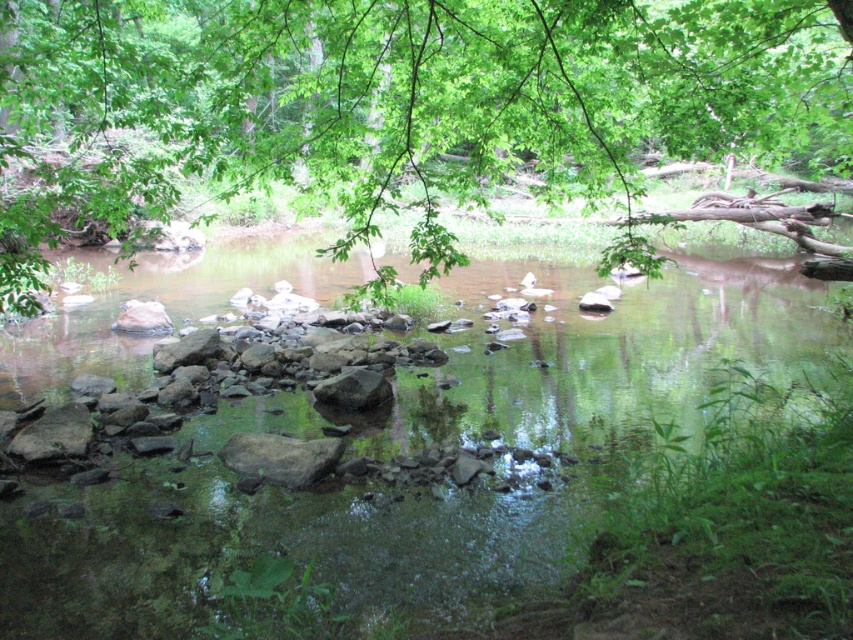
Who is positioned more to the right, green smooth water at center or green leafy branch at upper center?

From the viewer's perspective, green leafy branch at upper center appears more on the right side.

Can you confirm if green smooth water at center is shorter than green leafy branch at upper center?

Correct, green smooth water at center is not as tall as green leafy branch at upper center.

The height and width of the screenshot is (640, 853). What do you see at coordinates (419, 461) in the screenshot? I see `green smooth water at center` at bounding box center [419, 461].

Where is `green smooth water at center`? green smooth water at center is located at coordinates (419, 461).

Can you confirm if green leafy branch at upper center is taller than smooth gray rock at center?

Yes, green leafy branch at upper center is taller than smooth gray rock at center.

Can you confirm if green leafy branch at upper center is positioned above smooth gray rock at center?

Correct, green leafy branch at upper center is located above smooth gray rock at center.

This screenshot has width=853, height=640. Identify the location of green leafy branch at upper center. (403, 104).

Find the location of a particular element. green leafy branch at upper center is located at coordinates (403, 104).

Does green smooth water at center lie behind smooth gray rock at center?

No, green smooth water at center is closer to the viewer.

Does point (780, 342) come farther from viewer compared to point (352, 403)?

Yes, point (780, 342) is farther from viewer.

Who is more forward, (419, 381) or (376, 381)?

Point (376, 381)

Locate an element on the screen. The width and height of the screenshot is (853, 640). green smooth water at center is located at coordinates (419, 461).